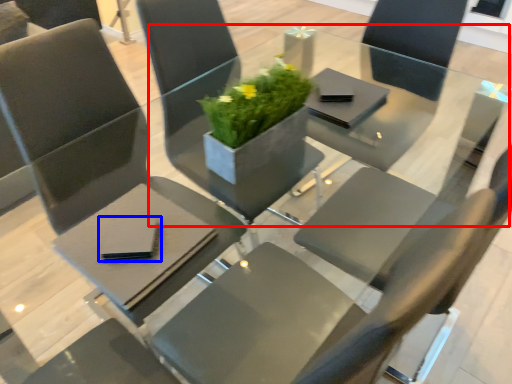
Question: Which object appears closest to the camera in this image, round table (highlighted by a red box) or pad (highlighted by a blue box)?

Choices:
 (A) round table
 (B) pad

Answer: (B)